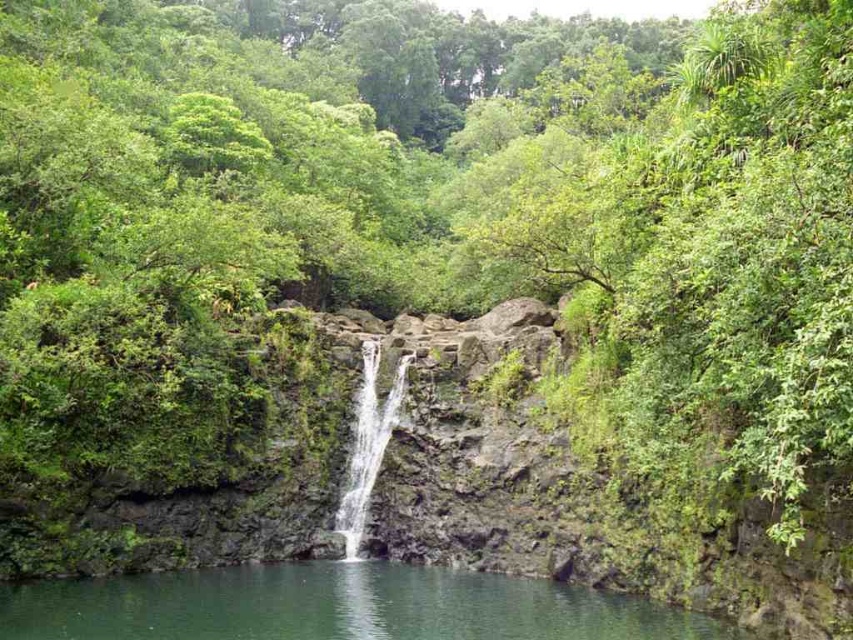
Question: Which point is farther from the camera taking this photo?

Choices:
 (A) (374, 420)
 (B) (334, 589)

Answer: (A)

Question: Does green smooth water at center appear on the right side of clear water at center?

Choices:
 (A) yes
 (B) no

Answer: (A)

Question: Considering the relative positions of green smooth water at center and clear water at center in the image provided, where is green smooth water at center located with respect to clear water at center?

Choices:
 (A) above
 (B) below

Answer: (B)

Question: In this image, where is green smooth water at center located relative to clear water at center?

Choices:
 (A) right
 (B) left

Answer: (A)